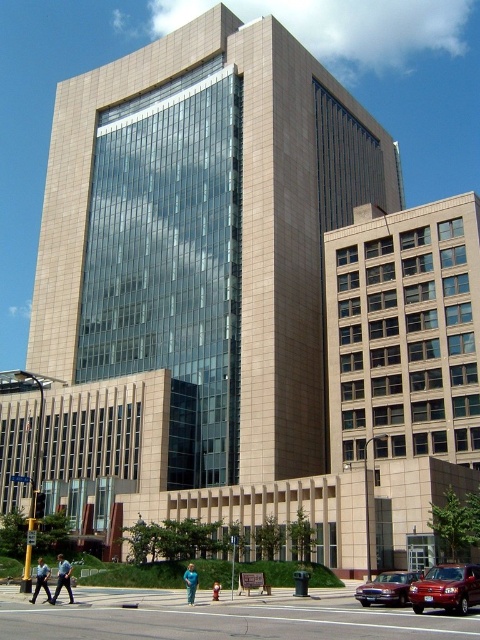
Question: Can you confirm if shiny red car at lower right is positioned to the left of dark blue uniform at lower left?

Choices:
 (A) yes
 (B) no

Answer: (B)

Question: Is shiny red car at lower right closer to camera compared to dark blue uniform at lower left?

Choices:
 (A) yes
 (B) no

Answer: (A)

Question: Which point is farther to the camera?

Choices:
 (A) shiny red car at lower right
 (B) dark blue jeans at lower left
 (C) shiny maroon sedan at lower right

Answer: (B)

Question: Which point is closer to the camera?

Choices:
 (A) (215, 593)
 (B) (69, 593)
 (C) (193, 579)
 (D) (444, 596)

Answer: (D)

Question: Does shiny maroon sedan at lower right come in front of blue fabric person at lower center?

Choices:
 (A) no
 (B) yes

Answer: (B)

Question: Among these points, which one is farthest from the camera?

Choices:
 (A) [x=459, y=580]
 (B) [x=217, y=593]
 (C) [x=369, y=596]
 (D) [x=60, y=556]

Answer: (D)